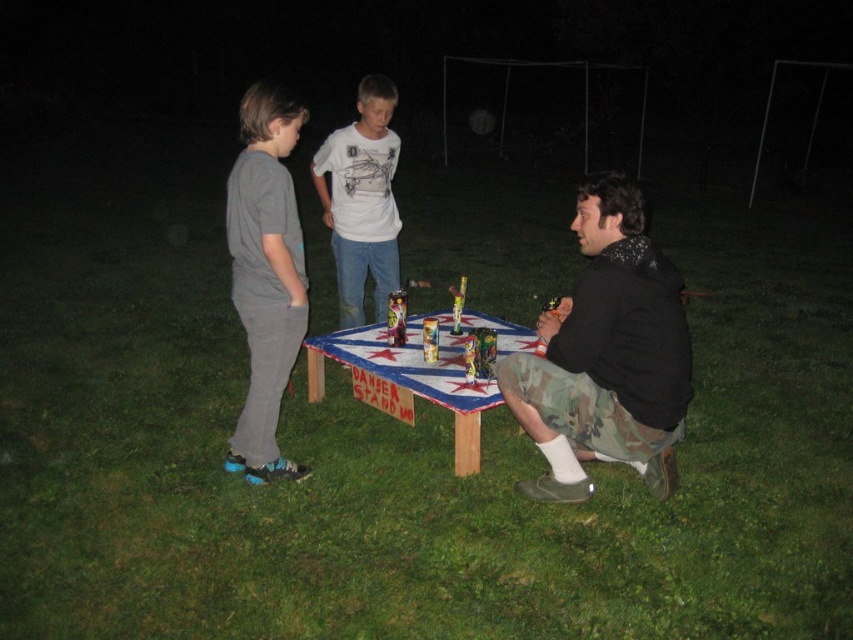
Question: Which object is closer to the camera taking this photo?

Choices:
 (A) camo shorts at lower right
 (B) gray cotton pants at left
 (C) white cotton shirt at center

Answer: (A)

Question: Observing the image, what is the correct spatial positioning of gray cotton pants at left in reference to wooden painted table at center?

Choices:
 (A) left
 (B) right

Answer: (A)

Question: Does gray cotton pants at left appear on the right side of white cotton shirt at center?

Choices:
 (A) yes
 (B) no

Answer: (B)

Question: Which point is farther to the camera?

Choices:
 (A) (587, 358)
 (B) (396, 237)

Answer: (B)

Question: Among these objects, which one is nearest to the camera?

Choices:
 (A) camo shorts at lower right
 (B) gray cotton pants at left
 (C) white cotton shirt at center

Answer: (A)

Question: Does gray cotton pants at left have a greater width compared to wooden painted table at center?

Choices:
 (A) yes
 (B) no

Answer: (B)